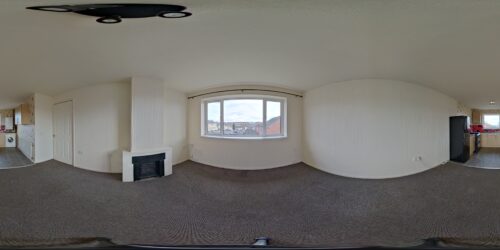
Find the location of a particular element. bare white wall space is located at coordinates (410, 118), (357, 137), (334, 118), (282, 144), (224, 155), (171, 116), (151, 117), (113, 124), (93, 123), (38, 115).